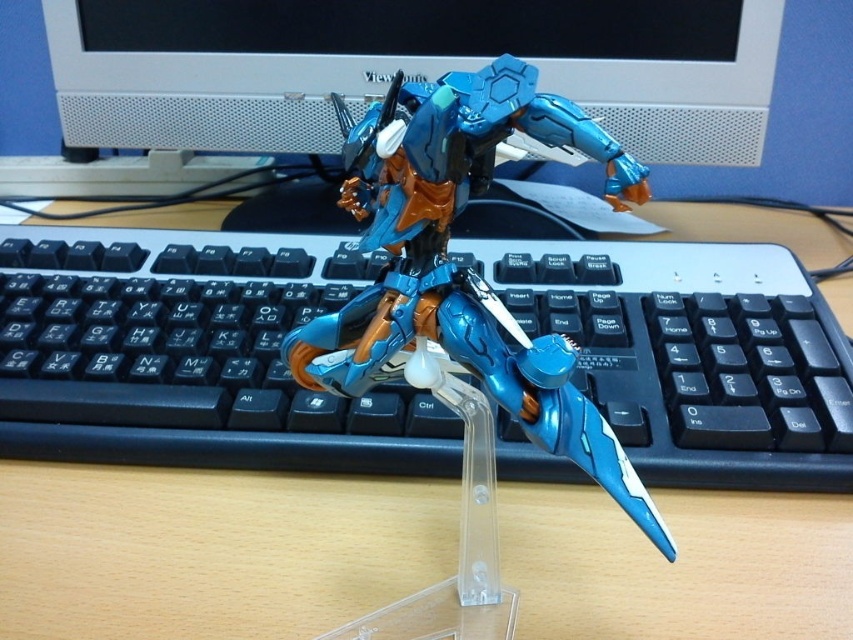
In the scene shown: Can you confirm if black plastic keyboard at center is shorter than satin white monitor at upper center?

Incorrect, black plastic keyboard at center's height does not fall short of satin white monitor at upper center's.

Who is more forward, [337,291] or [279,88]?

Positioned in front is point [337,291].

The width and height of the screenshot is (853, 640). I want to click on black plastic keyboard at center, so click(x=190, y=355).

Between point (148, 38) and point (384, 326), which one is positioned in front?

Point (384, 326)

Based on the photo, does satin white monitor at upper center have a lesser height compared to metallic blue robot at center?

Correct, satin white monitor at upper center is not as tall as metallic blue robot at center.

Describe the element at coordinates (407, 67) in the screenshot. I see `satin white monitor at upper center` at that location.

The width and height of the screenshot is (853, 640). What are the coordinates of `satin white monitor at upper center` in the screenshot? It's located at tap(407, 67).

Who is taller, black plastic keyboard at center or metallic blue robot at center?

metallic blue robot at center is taller.

Who is shorter, black plastic keyboard at center or metallic blue robot at center?

Standing shorter between the two is black plastic keyboard at center.

At what (x,y) coordinates should I click in order to perform the action: click on black plastic keyboard at center. Please return your answer as a coordinate pair (x, y). The image size is (853, 640). Looking at the image, I should click on (190, 355).

The height and width of the screenshot is (640, 853). What are the coordinates of `black plastic keyboard at center` in the screenshot? It's located at (190, 355).